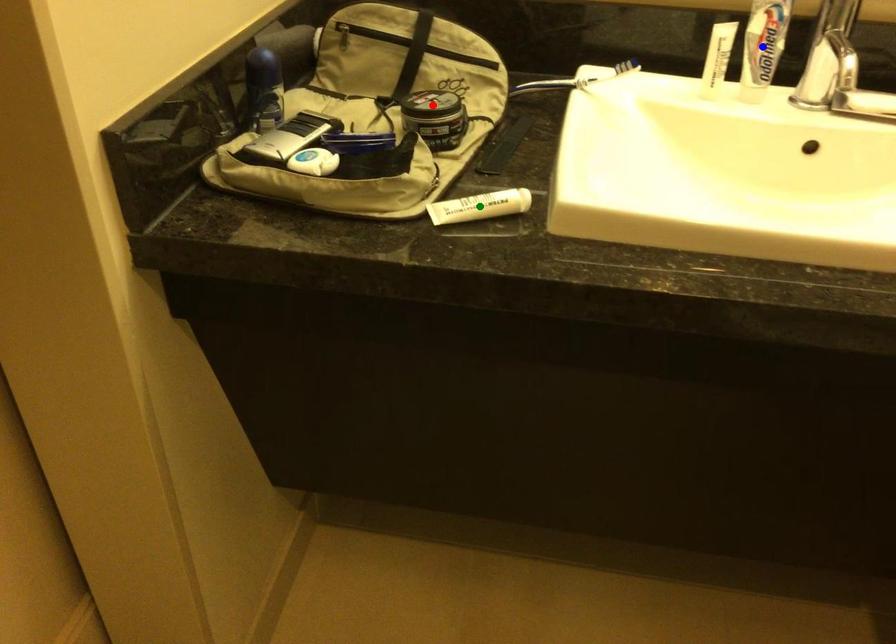
Order these from farthest to nearest:
green point
red point
blue point

blue point
red point
green point